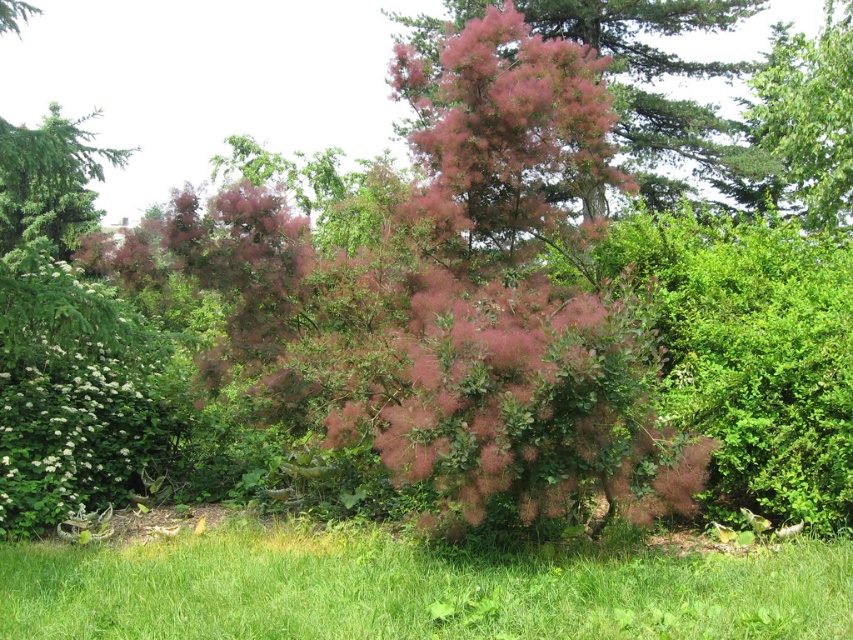
You are standing in the garden looking at the central pink shrub. There are two points marked in the scene. One is at coordinates point (811, 106) and the other is at point (50, 104). Which of these points is closer to you?

Point (811, 106) is in front of point (50, 104), so it is closer to you.

You are a gardener who wants to plant a new flower bed between the green grass at lower center and the pink fluffy bush at center. Since you need to know the sizes of both areas to plan the spacing, can you tell me which one is larger?

The pink fluffy bush at center is larger than the green grass at lower center, so the flower bed should be placed accordingly to accommodate the size difference.

You are standing in the garden and want to take a closer look at the white fluffy bush at lower left. If you walk straight towards it, how far will you have to walk to reach it?

The distance between you and the white fluffy bush at lower left is 7.07 meters, so you will have to walk 7.07 meters to reach it.